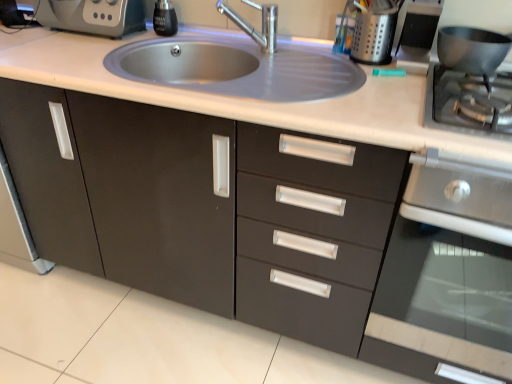
Where is `vacant area that lies between satin steel sink at center and teal plastic marker at upper right, the second appliance in the right-to-left sequence`? This screenshot has height=384, width=512. vacant area that lies between satin steel sink at center and teal plastic marker at upper right, the second appliance in the right-to-left sequence is located at coordinates (385, 92).